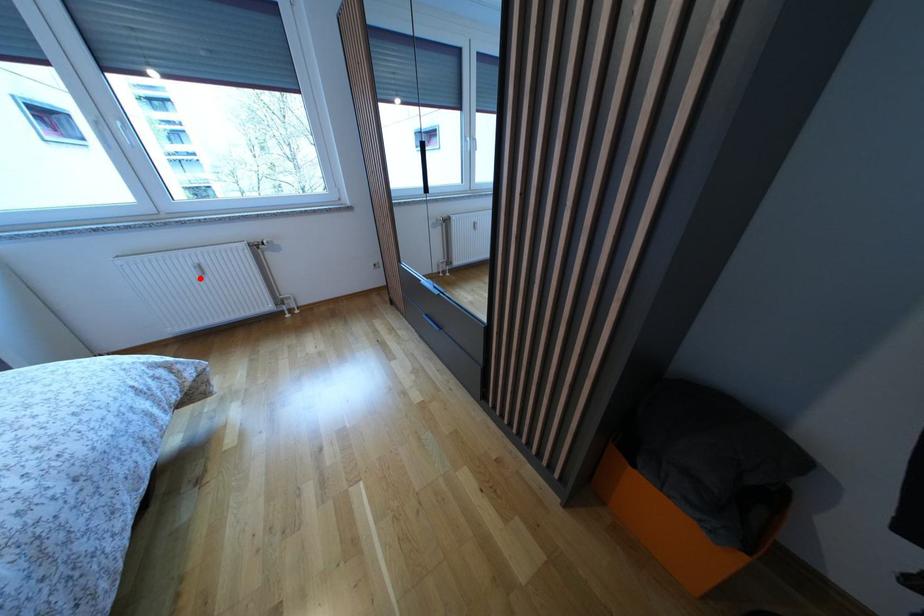
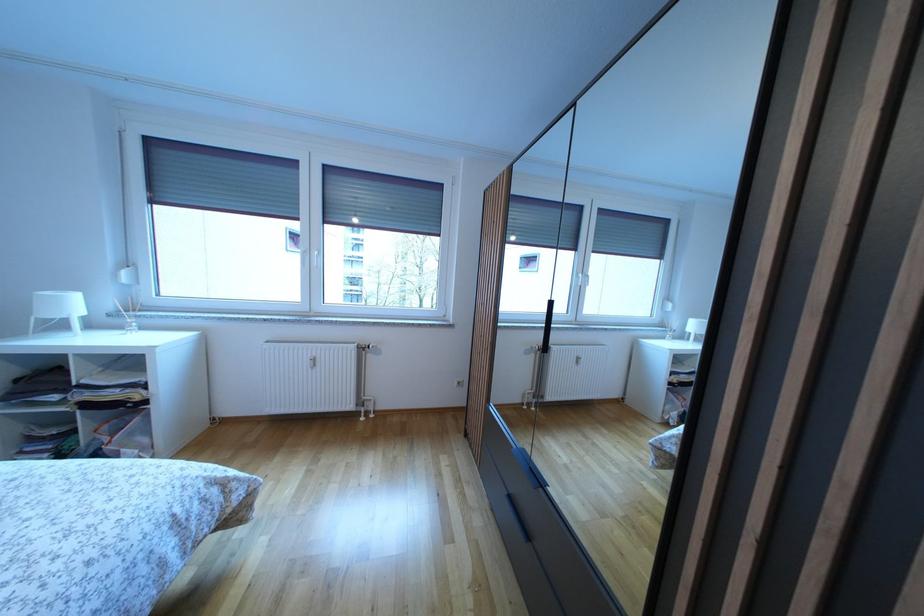
Where in the second image is the point corresponding to the highlighted location from the first image?

(314, 370)